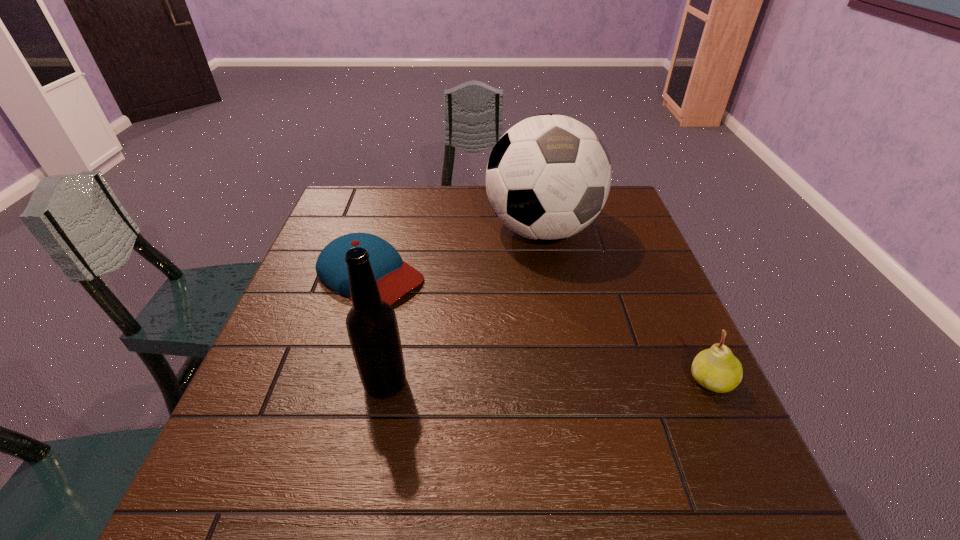
This screenshot has height=540, width=960. Find the location of `beer bottle`. beer bottle is located at coordinates (371, 323).

You are a GUI agent. You are given a task and a screenshot of the screen. Output one action in this format:
    pyautogui.click(x=<x>, y=<y>)
    Task: Click on the third tallest object
    The height and width of the screenshot is (540, 960).
    Given the screenshot: What is the action you would take?
    pyautogui.click(x=716, y=369)

Locate an element on the screen. Image resolution: width=960 pixels, height=540 pixels. the rightmost object is located at coordinates (716, 369).

Image resolution: width=960 pixels, height=540 pixels. Find the location of `the second object from right to left`. the second object from right to left is located at coordinates (548, 177).

Where is `baseball cap`? baseball cap is located at coordinates (394, 277).

Where is `free space located on the right of the beer bottle`? This screenshot has height=540, width=960. free space located on the right of the beer bottle is located at coordinates [547, 383].

Find the location of `vacant area situated on the left of the pear`. vacant area situated on the left of the pear is located at coordinates (643, 381).

I want to click on free location located on the main logo of the second object from right to left, so click(592, 397).

What are the coordinates of `vacant area situated on the main logo of the second object from right to left` in the screenshot? It's located at (570, 325).

You are a GUI agent. You are given a task and a screenshot of the screen. Output one action in this format:
    pyautogui.click(x=<x>, y=<y>)
    Task: Click on the free space located 0.370m on the main logo of the second object from right to left
    Image resolution: width=960 pixels, height=540 pixels.
    Given the screenshot: What is the action you would take?
    pyautogui.click(x=588, y=384)